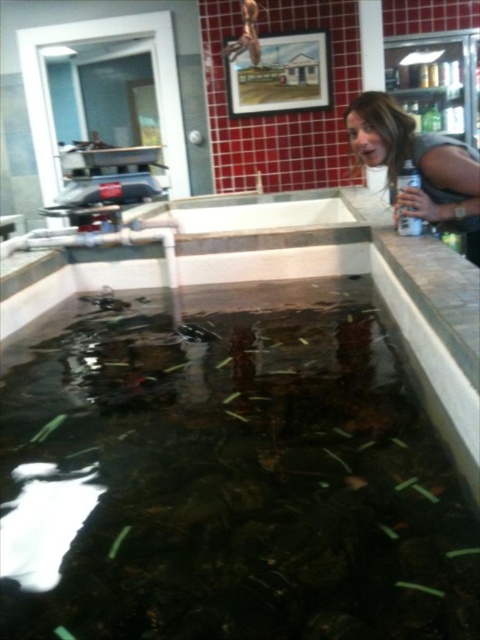
Question: Can you confirm if translucent glass tank at center is positioned below blonde hair at upper right?

Choices:
 (A) no
 (B) yes

Answer: (B)

Question: Does translucent glass tank at center appear on the right side of blonde hair at upper right?

Choices:
 (A) yes
 (B) no

Answer: (B)

Question: Among these points, which one is farthest from the camera?

Choices:
 (A) (382, 125)
 (B) (295, 560)

Answer: (A)

Question: Can you confirm if translucent glass tank at center is positioned above blonde hair at upper right?

Choices:
 (A) yes
 (B) no

Answer: (B)